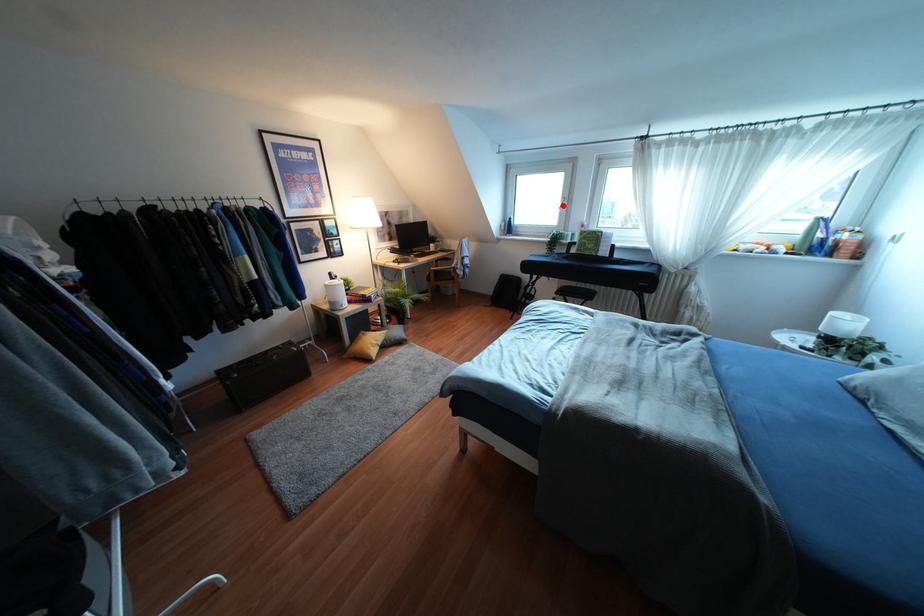
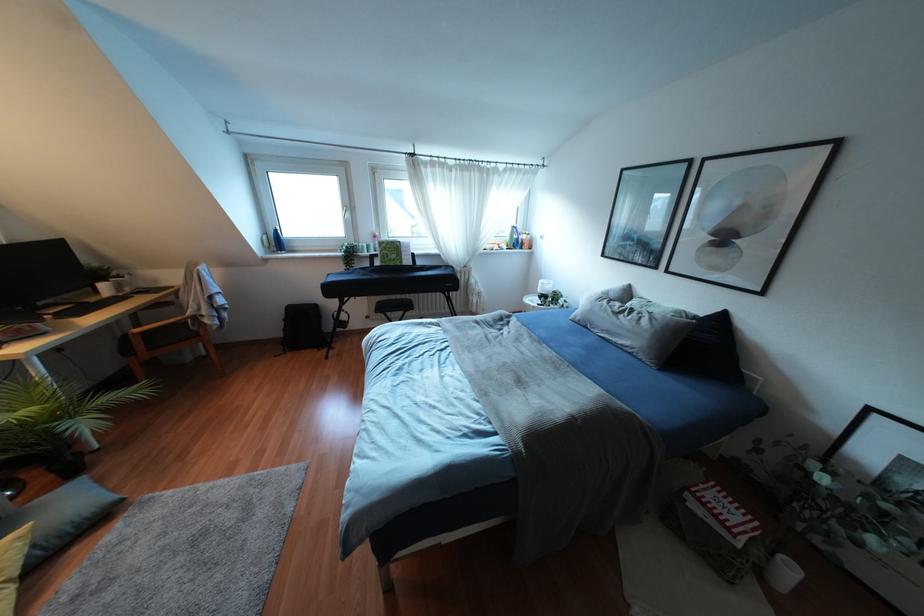
Find the pixel in the second image that matches the highlighted location in the first image.

(346, 215)